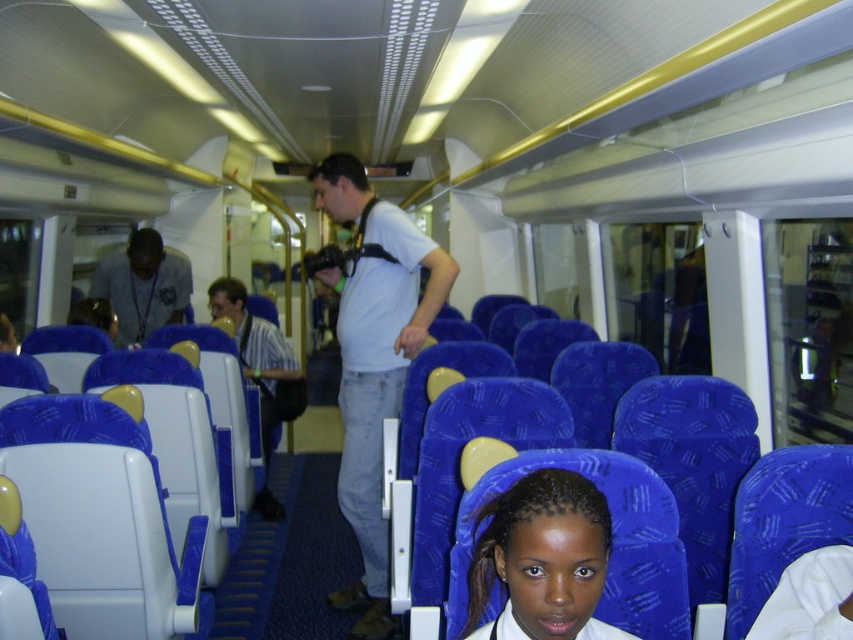
You are standing at the entrance of the train carriage and want to find the white matte shirt at center. According to the coordinates provided, where should you look relative to the entrance?

The white matte shirt at center is located at coordinates point (x=374, y=356), which means it is positioned approximately in the center of the carriage, slightly towards the back from the entrance.

You are a passenger on the train and see two people wearing shirts at the center of the carriage. The shirts are labeled as white matte shirt at center and striped shirt at center. Which shirt is positioned to the right when viewed from the front?

The white matte shirt at center is to the right of the striped shirt at center.